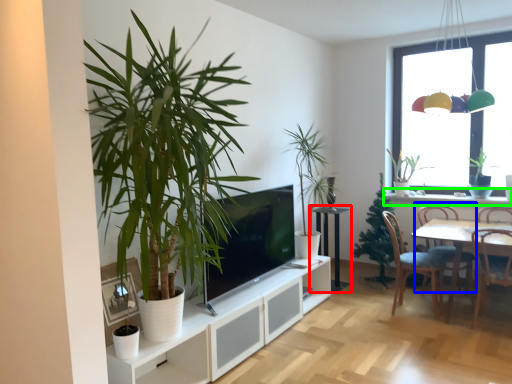
Question: Which is nearer to the table (highlighted by a red box)? chair (highlighted by a blue box) or window sill (highlighted by a green box).

Choices:
 (A) chair
 (B) window sill

Answer: (A)